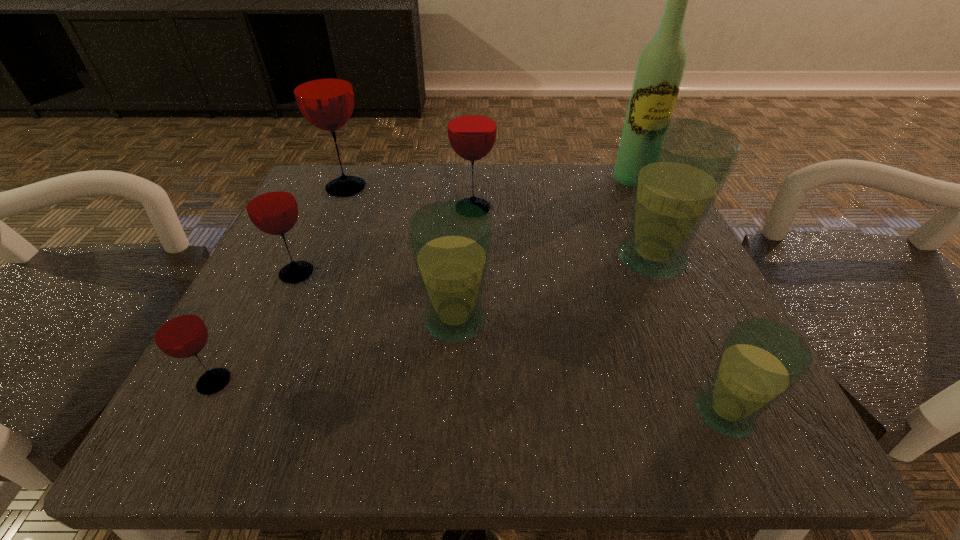
At what (x,y) coordinates should I click in order to perform the action: click on the smallest blue glass. Please return your answer as a coordinate pair (x, y). The width and height of the screenshot is (960, 540). Looking at the image, I should click on (761, 360).

This screenshot has height=540, width=960. I want to click on free space located 0.390m on the front-facing side of the tallest object, so click(707, 333).

Where is `free space located 0.250m on the right of the biggest red glass`? free space located 0.250m on the right of the biggest red glass is located at coordinates (490, 188).

Locate an element on the screen. free space located on the left of the rightmost red glass is located at coordinates (396, 209).

The image size is (960, 540). In order to click on free space located 0.110m on the back of the farthest blue glass in this screenshot , I will do `click(627, 202)`.

At what (x,y) coordinates should I click in order to perform the action: click on vacant region located on the right of the third biggest red glass. Please return your answer as a coordinate pair (x, y). Looking at the image, I should click on (516, 274).

Locate an element on the screen. This screenshot has height=540, width=960. free region located on the front of the second farthest blue glass is located at coordinates coord(451,392).

Where is `vacant region located on the back of the smallest red glass`? This screenshot has width=960, height=540. vacant region located on the back of the smallest red glass is located at coordinates (273, 268).

You are a GUI agent. You are given a task and a screenshot of the screen. Output one action in this format:
    pyautogui.click(x=<x>, y=<y>)
    Task: Click on the vacant space located 0.110m on the back of the smallest blue glass
    The width and height of the screenshot is (960, 540).
    Given the screenshot: What is the action you would take?
    pyautogui.click(x=684, y=322)

In order to click on wine bottle present at the far edge in this screenshot , I will do `click(659, 73)`.